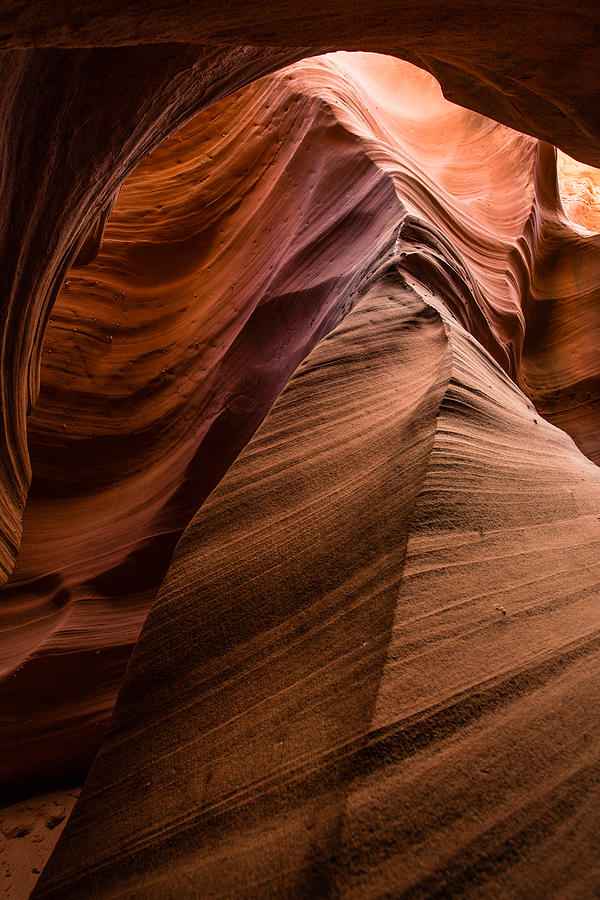
Locate an element on the screen. The height and width of the screenshot is (900, 600). eimpty space in upper right of wall is located at coordinates (577, 183).